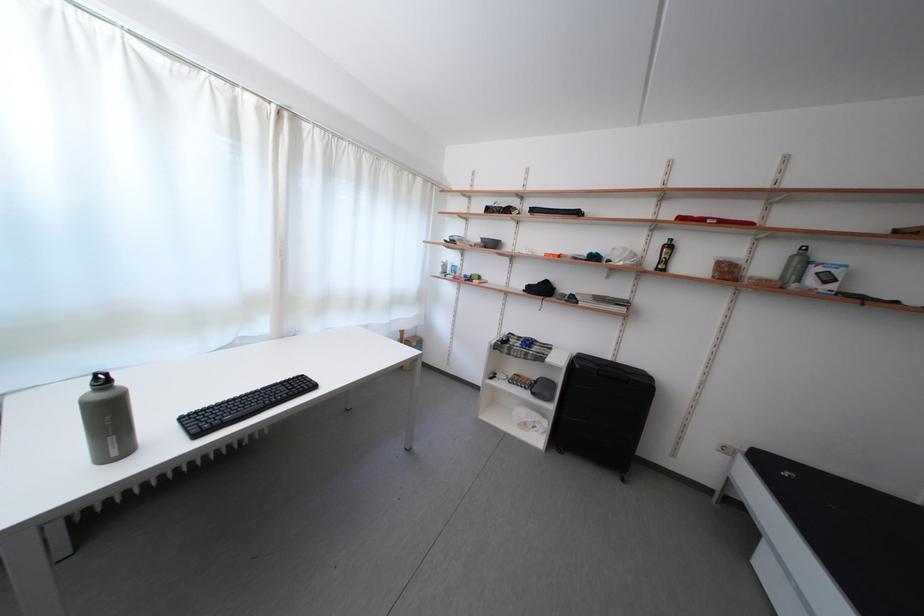
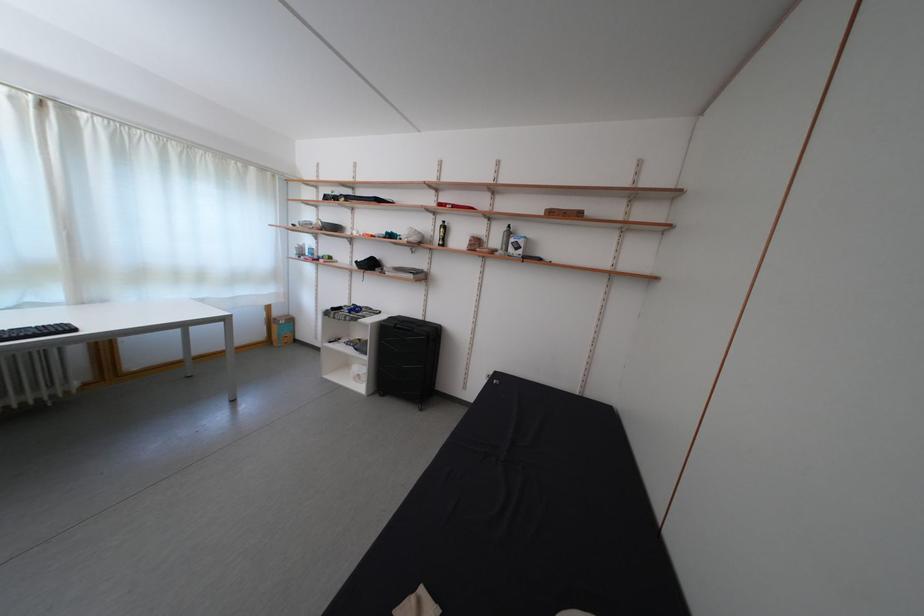
Where in the second image is the point corresponding to point 536,428 from the first image?

(365, 381)